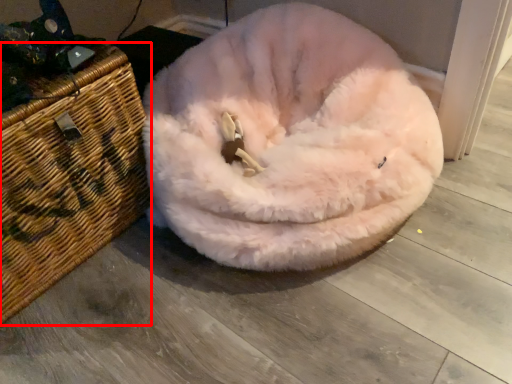
Question: From the image's perspective, what is the correct spatial relationship of basket (annotated by the red box) in relation to dog bed?

Choices:
 (A) above
 (B) below

Answer: (B)